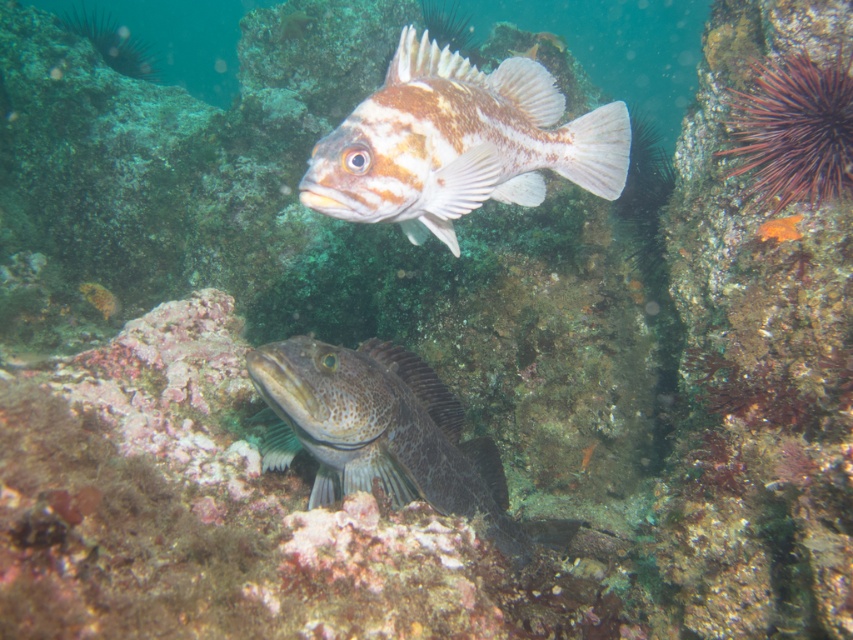
Does speckled brown fish at upper center have a smaller size compared to speckled dark gray fish at lower center?

Indeed, speckled brown fish at upper center has a smaller size compared to speckled dark gray fish at lower center.

Does speckled brown fish at upper center appear under speckled dark gray fish at lower center?

Actually, speckled brown fish at upper center is above speckled dark gray fish at lower center.

Is point (392, 170) behind point (338, 385)?

No, it is in front of (338, 385).

Where is `speckled brown fish at upper center`? The width and height of the screenshot is (853, 640). speckled brown fish at upper center is located at coordinates (457, 144).